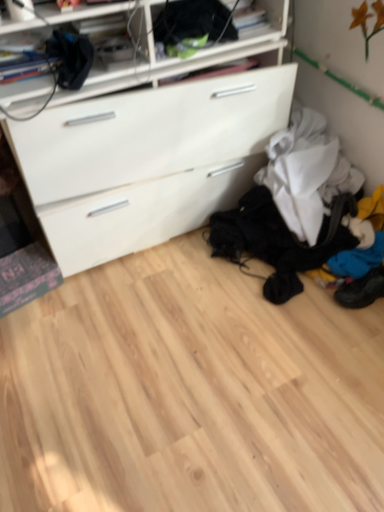
The height and width of the screenshot is (512, 384). Identify the location of black fabric at upper center. (255, 26).

The image size is (384, 512). What do you see at coordinates (255, 26) in the screenshot? I see `black fabric at upper center` at bounding box center [255, 26].

At what (x,y) coordinates should I click in order to perform the action: click on blue fabric shoe at lower right. Please return your answer as a coordinate pair (x, y). Image resolution: width=384 pixels, height=512 pixels. Looking at the image, I should click on (361, 290).

Describe the element at coordinates (361, 290) in the screenshot. This screenshot has width=384, height=512. I see `blue fabric shoe at lower right` at that location.

At what (x,y) coordinates should I click in order to perform the action: click on black fabric at upper center. Please return your answer as a coordinate pair (x, y). This screenshot has height=512, width=384. Looking at the image, I should click on (255, 26).

Considering the relative positions of blue fabric shoe at lower right and black fabric at upper center in the image provided, is blue fabric shoe at lower right to the right of black fabric at upper center from the viewer's perspective?

Indeed, blue fabric shoe at lower right is positioned on the right side of black fabric at upper center.

Considering their positions, is blue fabric shoe at lower right located in front of or behind black fabric at upper center?

blue fabric shoe at lower right is behind black fabric at upper center.

Between point (345, 297) and point (285, 10), which one is positioned in front?

Positioned in front is point (345, 297).

From the image's perspective, does blue fabric shoe at lower right appear lower than black fabric at upper center?

Yes, from the image's perspective, blue fabric shoe at lower right is beneath black fabric at upper center.

From a real-world perspective, which object stands above the other?

In real-world perspective, black fabric at upper center is above.

Can you confirm if blue fabric shoe at lower right is thinner than black fabric at upper center?

In fact, blue fabric shoe at lower right might be wider than black fabric at upper center.

Is blue fabric shoe at lower right shorter than black fabric at upper center?

Yes, blue fabric shoe at lower right is shorter than black fabric at upper center.

Considering the sizes of objects blue fabric shoe at lower right and black fabric at upper center in the image provided, who is bigger, blue fabric shoe at lower right or black fabric at upper center?

black fabric at upper center is bigger.

Is black fabric at upper center a part of blue fabric shoe at lower right?

No, blue fabric shoe at lower right does not contain black fabric at upper center.

Can you see blue fabric shoe at lower right touching black fabric at upper center?

No, blue fabric shoe at lower right is not in contact with black fabric at upper center.

Is blue fabric shoe at lower right positioned with its back to black fabric at upper center?

No.

How many degrees apart are the facing directions of blue fabric shoe at lower right and black fabric at upper center?

There is a 79.7-degree angle between the facing directions of blue fabric shoe at lower right and black fabric at upper center.

How much distance is there between blue fabric shoe at lower right and black fabric at upper center?

blue fabric shoe at lower right and black fabric at upper center are 1.01 meters apart from each other.

Locate an element on the screen. The image size is (384, 512). footwear on the right of the black fabric at upper center is located at coordinates (361, 290).

Considering the positions of objects black fabric at upper center and blue fabric shoe at lower right in the image provided, who is more to the left, black fabric at upper center or blue fabric shoe at lower right?

From the viewer's perspective, black fabric at upper center appears more on the left side.

Looking at this image, which is behind, black fabric at upper center or blue fabric shoe at lower right?

blue fabric shoe at lower right is behind.

Does point (256, 31) come in front of point (367, 291)?

That is True.

From the image's perspective, which is below, black fabric at upper center or blue fabric shoe at lower right?

blue fabric shoe at lower right.

From a real-world perspective, is black fabric at upper center positioned above or below blue fabric shoe at lower right?

black fabric at upper center is above blue fabric shoe at lower right.

Does black fabric at upper center have a lesser width compared to blue fabric shoe at lower right?

Correct, the width of black fabric at upper center is less than that of blue fabric shoe at lower right.

Considering the relative sizes of black fabric at upper center and blue fabric shoe at lower right in the image provided, is black fabric at upper center taller than blue fabric shoe at lower right?

Correct, black fabric at upper center is much taller as blue fabric shoe at lower right.

In the scene shown: Is black fabric at upper center smaller than blue fabric shoe at lower right?

Actually, black fabric at upper center might be larger than blue fabric shoe at lower right.

Is blue fabric shoe at lower right inside black fabric at upper center?

No.

Is black fabric at upper center with blue fabric shoe at lower right?

They are not placed beside each other.

Is black fabric at upper center oriented towards blue fabric shoe at lower right?

No, black fabric at upper center is not oriented towards blue fabric shoe at lower right.

What's the angular difference between black fabric at upper center and blue fabric shoe at lower right's facing directions?

79.7 degrees separate the facing orientations of black fabric at upper center and blue fabric shoe at lower right.

How far apart are black fabric at upper center and blue fabric shoe at lower right?

The distance of black fabric at upper center from blue fabric shoe at lower right is 1.01 meters.

Locate an element on the screen. The width and height of the screenshot is (384, 512). footwear behind the black fabric at upper center is located at coordinates (361, 290).

The width and height of the screenshot is (384, 512). I want to click on shelf in front of the blue fabric shoe at lower right, so click(255, 26).

In order to click on footwear below the black fabric at upper center (from a real-world perspective) in this screenshot , I will do `click(361, 290)`.